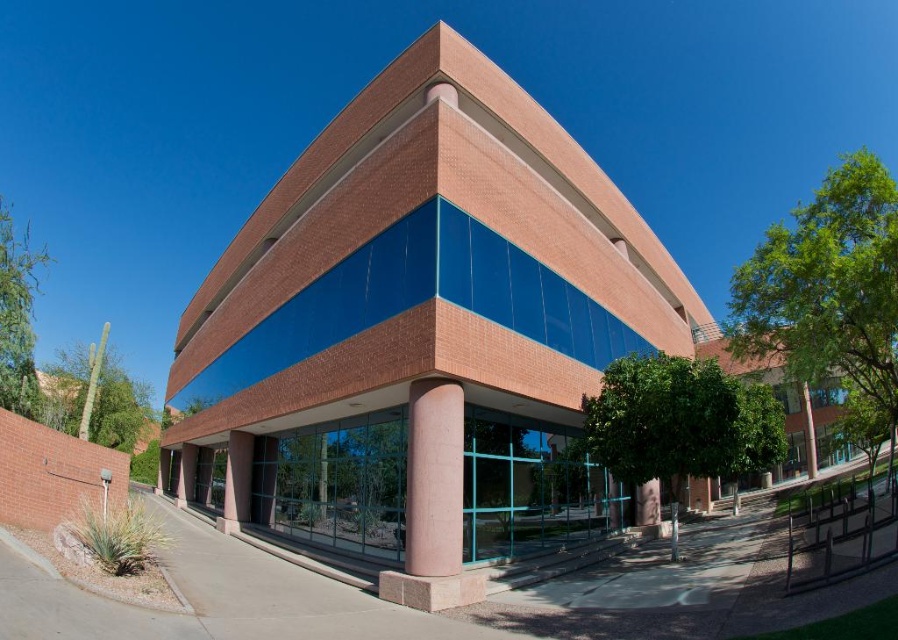
Which of these two, pink concrete column at center or smooth concrete pillar at lower center, stands shorter?

With less height is smooth concrete pillar at lower center.

Can you confirm if pink concrete column at center is positioned to the right of smooth concrete pillar at lower center?

Indeed, pink concrete column at center is positioned on the right side of smooth concrete pillar at lower center.

Locate an element on the screen. This screenshot has width=898, height=640. pink concrete column at center is located at coordinates (434, 477).